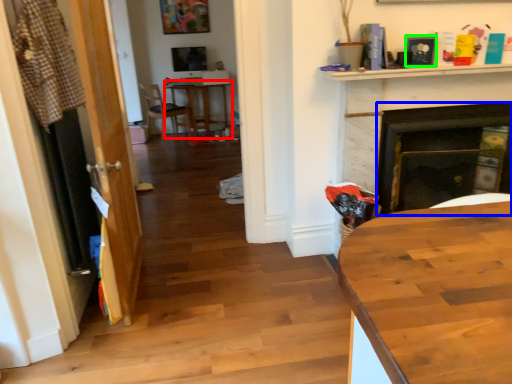
Question: Which is farther away from round table (highlighted by a red box)? fireplace (highlighted by a blue box) or picture frame (highlighted by a green box)?

Choices:
 (A) fireplace
 (B) picture frame

Answer: (B)